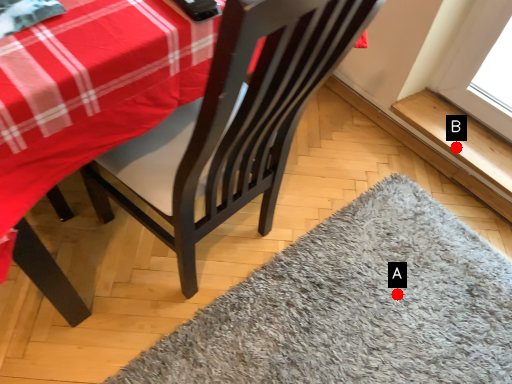
Question: Two points are circled on the image, labeled by A and B beside each circle. Which of the following is the closest to the observer?

Choices:
 (A) A is closer
 (B) B is closer

Answer: (A)